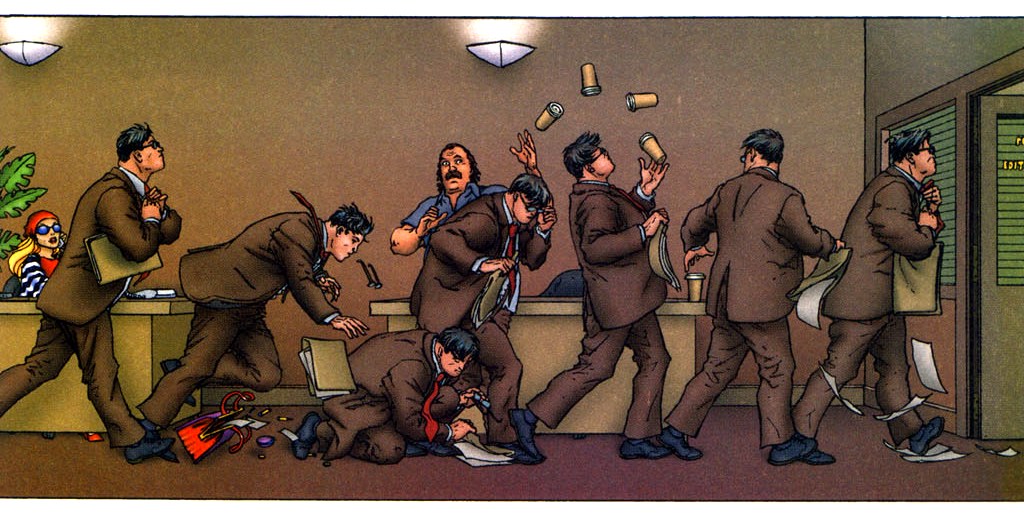
I want to click on plant, so click(x=15, y=172).